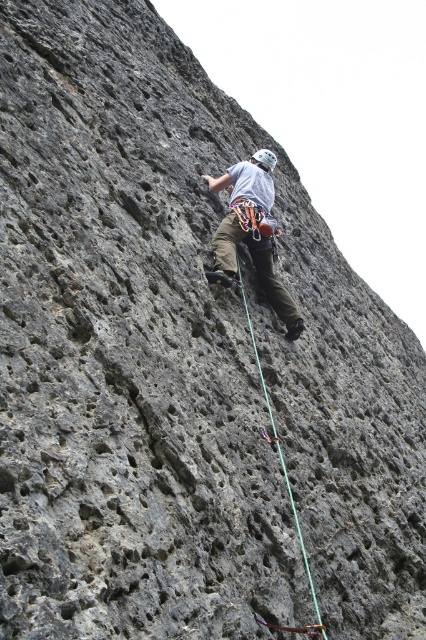
Is matte gray climbing harness at center positioned in front of green nylon rope at center?

No.

Between point (224, 259) and point (249, 321), which one is positioned in front?

Point (249, 321)

Where is `matte gray climbing harness at center`? matte gray climbing harness at center is located at coordinates (250, 232).